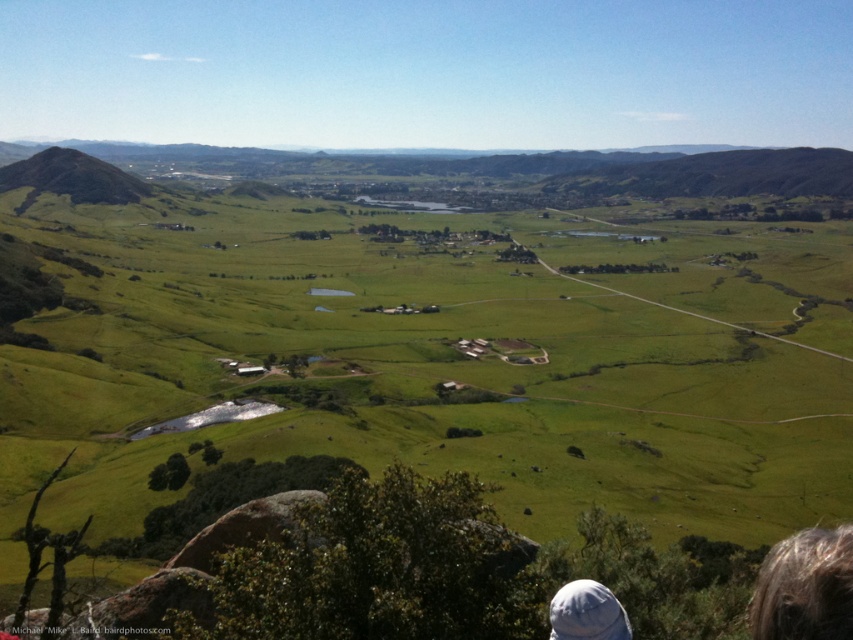
You are standing at the top of the green grassy hill at left and want to look for the white fabric cap at lower right. Which direction should you walk to see it?

You should walk towards the lower right direction because the white fabric cap at lower right is located in that direction from the green grassy hill at left.

You are a photographer trying to capture the person at the bottom right corner of the valley scene. Which object, the dark brown hair at lower right or the white fabric cap at lower right, should you focus on if you want to ensure the subject is clearly visible in your photo?

The dark brown hair at lower right is larger in size than the white fabric cap at lower right, so focusing on the dark brown hair at lower right would ensure the subject is more clearly visible in the photo.